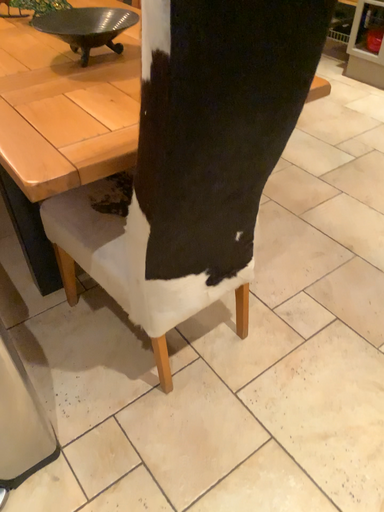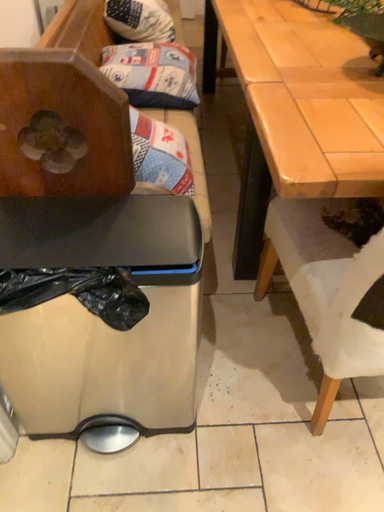
Question: Which way did the camera rotate in the video?

Choices:
 (A) rotated right
 (B) rotated left

Answer: (B)